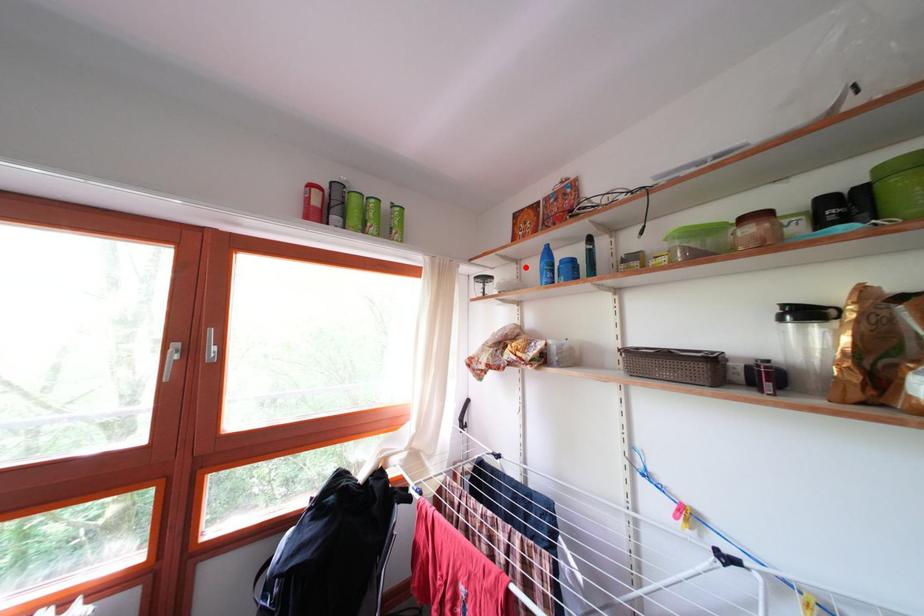
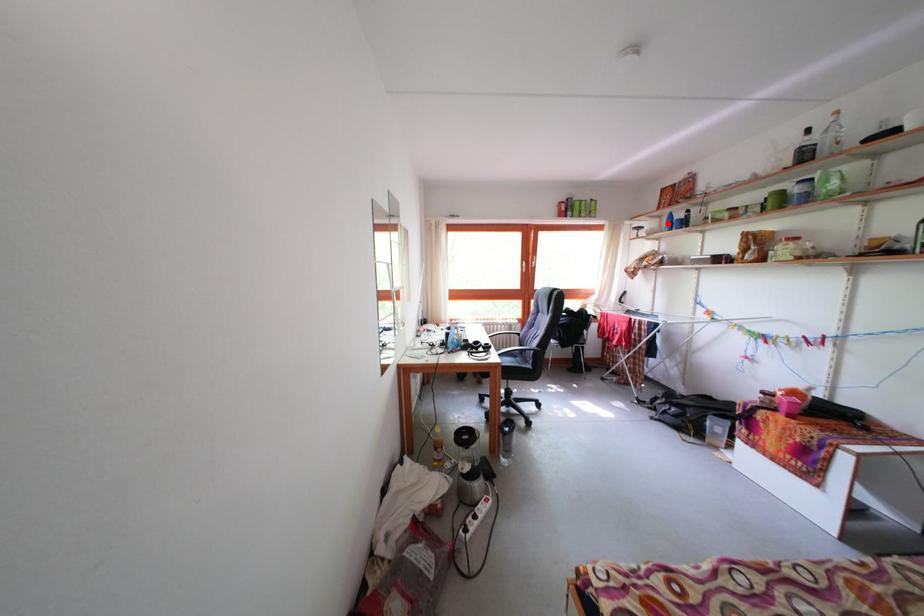
I am providing you with two images of the same scene from different viewpoints. A red point is marked on the first image and another point is marked on the second image. Are the points marked in image1 and image2 representing the same 3D position?

Yes